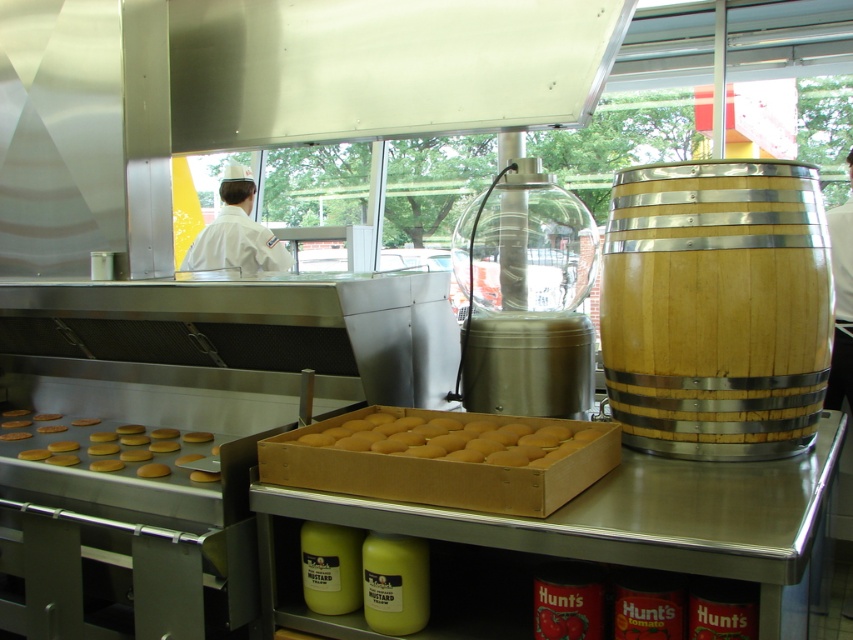
Is wooden barrel at right below golden matte cookies at center?

No, wooden barrel at right is not below golden matte cookies at center.

Between point (670, 262) and point (165, 474), which one is positioned behind?

Positioned behind is point (165, 474).

Locate an element on the screen. The image size is (853, 640). wooden barrel at right is located at coordinates (717, 308).

Between golden matte cookies at lower left and white uniform at center, which one is positioned lower?

golden matte cookies at lower left

Which is more to the right, golden matte cookies at lower left or white uniform at center?

Positioned to the right is golden matte cookies at lower left.

This screenshot has width=853, height=640. Find the location of `golden matte cookies at lower left`. golden matte cookies at lower left is located at coordinates (107, 452).

Between golden matte cookies at lower left and golden matte hamburger buns at lower left, which one has less height?

golden matte hamburger buns at lower left is shorter.

Based on the photo, does golden matte cookies at lower left lie behind golden matte hamburger buns at lower left?

No, golden matte cookies at lower left is in front of golden matte hamburger buns at lower left.

Between point (180, 448) and point (204, 435), which one is positioned behind?

The point (204, 435) is more distant.

You are a GUI agent. You are given a task and a screenshot of the screen. Output one action in this format:
    pyautogui.click(x=<x>, y=<y>)
    Task: Click on the golden matte cookies at lower left
    The width and height of the screenshot is (853, 640).
    Given the screenshot: What is the action you would take?
    pyautogui.click(x=107, y=452)